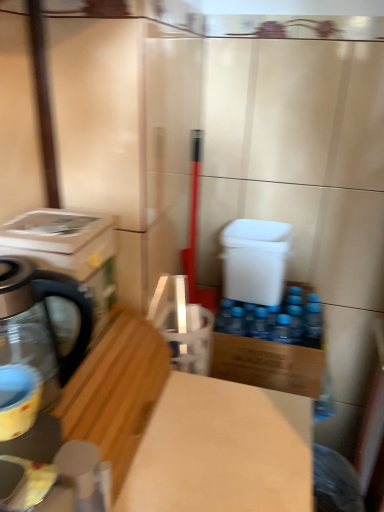
This screenshot has width=384, height=512. What do you see at coordinates (254, 260) in the screenshot? I see `white plastic water cooler at center` at bounding box center [254, 260].

Measure the distance between white plastic water cooler at center and camera.

1.17 meters.

Measure the distance between point [259,341] and camera.

A distance of 1.21 meters exists between point [259,341] and camera.

In order to face matte black kettle at left, should I rotate leftwards or rightwards?

You should look left and rotate roughly 20.061 degrees.

Image resolution: width=384 pixels, height=512 pixels. What do you see at coordinates (68, 249) in the screenshot? I see `white glossy washing machine at left` at bounding box center [68, 249].

Find the location of a particular element. matte yellow cup at left is located at coordinates (18, 399).

Which of these two, wooden cutting board at lower left or light brown wood at center, stands taller?

Standing taller between the two is light brown wood at center.

From a real-world perspective, is wooden cutting board at lower left below light brown wood at center?

No, from a real-world perspective, wooden cutting board at lower left is not beneath light brown wood at center.

Which object is further away from the camera taking this photo, wooden cutting board at lower left or light brown wood at center?

light brown wood at center is more distant.

Is wooden cutting board at lower left oriented away from light brown wood at center?

That's not correct — wooden cutting board at lower left is not looking away from light brown wood at center.

From the image's perspective, relative to matte yellow cup at left, is light brown wood at center above or below?

light brown wood at center is situated lower than matte yellow cup at left in the image.

Consider the image. Is light brown wood at center aimed at matte yellow cup at left?

No.

Locate an element on the screen. The height and width of the screenshot is (512, 384). appliance to the left of light brown wood at center is located at coordinates (18, 399).

Does light brown wood at center have a smaller size compared to matte black kettle at left?

No, light brown wood at center is not smaller than matte black kettle at left.

From a real-world perspective, is light brown wood at center beneath matte black kettle at left?

Correct, in the physical world, light brown wood at center is lower than matte black kettle at left.

Can you confirm if wooden cutting board at lower left is thinner than white plastic water cooler at center?

Incorrect, the width of wooden cutting board at lower left is not less than that of white plastic water cooler at center.

I want to click on water cooler that is above the wooden cutting board at lower left (from the image's perspective), so click(254, 260).

Which point is more forward, (92,307) or (73,258)?

The point (73,258) is closer.

From a real-world perspective, is matte black kettle at left above or below white glossy washing machine at left?

matte black kettle at left is below white glossy washing machine at left.

Considering the sizes of objects matte black kettle at left and white glossy washing machine at left in the image provided, who is taller, matte black kettle at left or white glossy washing machine at left?

With more height is matte black kettle at left.

From the image's perspective, is light brown wood at center positioned above or below white plastic water cooler at center?

light brown wood at center is below white plastic water cooler at center.

Consider the image. Considering the relative sizes of light brown wood at center and white plastic water cooler at center in the image provided, is light brown wood at center shorter than white plastic water cooler at center?

No, light brown wood at center is not shorter than white plastic water cooler at center.

Which object is closer to the camera taking this photo, light brown wood at center or white plastic water cooler at center?

light brown wood at center is more forward.

Is light brown wood at center looking in the opposite direction of white plastic water cooler at center?

light brown wood at center is not turned away from white plastic water cooler at center.

Is matte black kettle at left bigger or smaller than light brown wood at center?

Clearly, matte black kettle at left is smaller in size than light brown wood at center.

Is matte black kettle at left positioned in front of light brown wood at center?

Yes, it is in front of light brown wood at center.

Is matte black kettle at left not inside light brown wood at center?

matte black kettle at left lies outside light brown wood at center's area.

Find the location of a particular element. workbench that appears on the right of wooden cutting board at lower left is located at coordinates [x=116, y=389].

What are the coordinates of `workbench below the matte yellow cup at left (from the image's perspective)` in the screenshot? It's located at (116, 389).

Consider the image. Based on their spatial positions, is light brown wood at center or white glossy washing machine at left closer to matte yellow cup at left?

white glossy washing machine at left.

In the scene shown: Considering their positions, is matte yellow cup at left positioned further to white plastic water cooler at center than wooden cutting board at lower left?

Based on the image, matte yellow cup at left appears to be further to white plastic water cooler at center.

Which object lies nearer to the anchor point white plastic water cooler at center, white glossy washing machine at left or wooden cutting board at lower left?

Among the two, wooden cutting board at lower left is located nearer to white plastic water cooler at center.

Based on their spatial positions, is light brown wood at center or wooden cutting board at lower left closer to white plastic water cooler at center?

light brown wood at center.

Considering their positions, is matte black kettle at left positioned closer to matte yellow cup at left than white glossy washing machine at left?

matte black kettle at left is closer to matte yellow cup at left.

From the image, which object appears to be nearer to white plastic water cooler at center, matte yellow cup at left or light brown wood at center?

The object closer to white plastic water cooler at center is light brown wood at center.

Looking at the image, which one is located closer to white plastic water cooler at center, light brown wood at center or matte yellow cup at left?

light brown wood at center.

Looking at the image, which one is located closer to wooden cutting board at lower left, matte black kettle at left or white glossy washing machine at left?

matte black kettle at left lies closer to wooden cutting board at lower left than the other object.

Locate an element on the screen. The width and height of the screenshot is (384, 512). appliance between white glossy washing machine at left and light brown wood at center in the up-down direction is located at coordinates (18, 399).

Find the location of `washing machine positioned between wooden cutting board at lower left and white plastic water cooler at center from near to far`. washing machine positioned between wooden cutting board at lower left and white plastic water cooler at center from near to far is located at coordinates (68, 249).

At what (x,y) coordinates should I click in order to perform the action: click on wood located between matte black kettle at left and white plastic water cooler at center in the depth direction. Please return your answer as a coordinate pair (x, y). The height and width of the screenshot is (512, 384). Looking at the image, I should click on (116, 390).

I want to click on appliance between white glossy washing machine at left and wooden cutting board at lower left in the vertical direction, so click(18, 399).